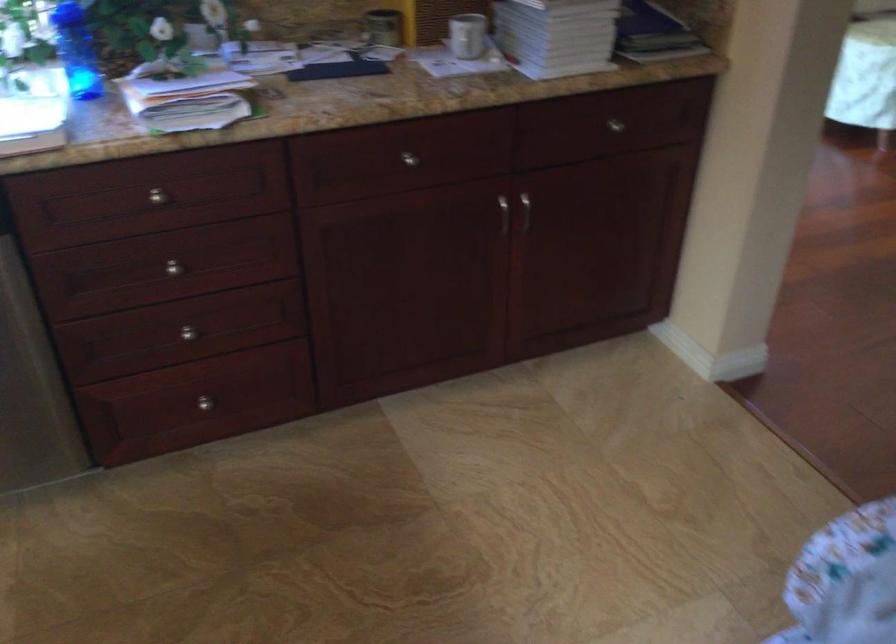
Where would you lift the white coffee mug? Please return your answer as a coordinate pair (x, y).

(467, 35)